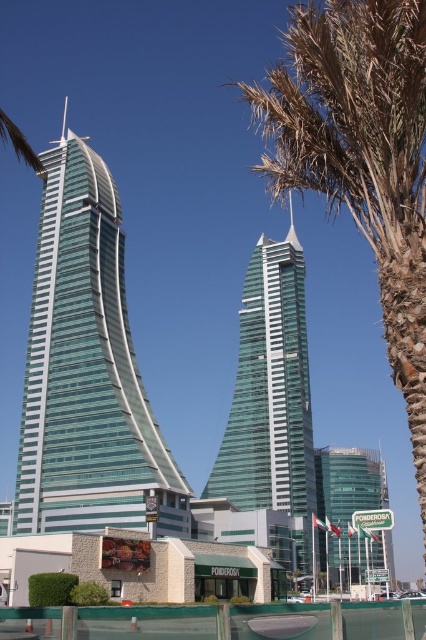
You are a drone operator tasked with capturing aerial footage of the translucent glass skyscraper at center and the transparent glass tower at center. Your drone has a limited flight altitude of 500 meters. Can you confirm if the drone can safely fly above both structures without exceeding its altitude limit?

The translucent glass skyscraper at center is above the transparent glass tower at center, but the exact height of each structure isn

You are a drone operator trying to fly your drone from the translucent glass skyscraper at center to the green leafy palm tree at upper right. Based on their positions, can your drone navigate downwards from the skyscraper to the palm tree?

The translucent glass skyscraper at center is above the green leafy palm tree at upper right, so yes, the drone can navigate downwards from the skyscraper to the palm tree since it is positioned higher.